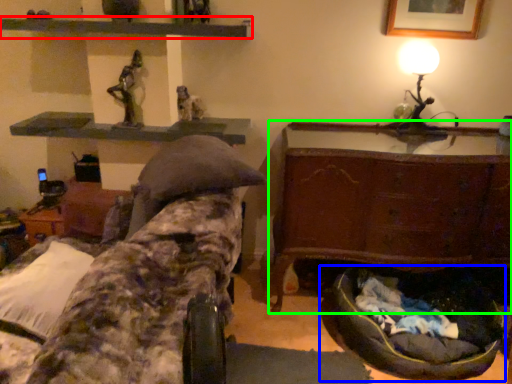
Question: Considering the real-world distances, which object is closest to shelf (highlighted by a red box)? bean bag chair (highlighted by a blue box) or furniture (highlighted by a green box).

Choices:
 (A) bean bag chair
 (B) furniture

Answer: (B)